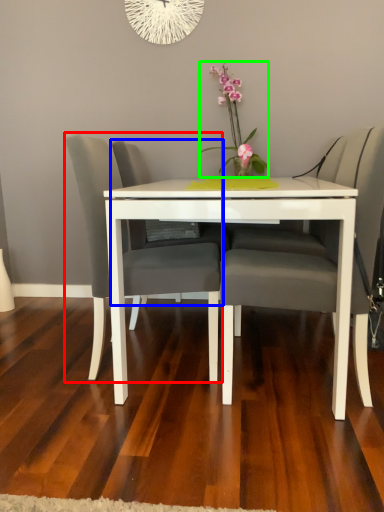
Question: Which object is the farthest from chair (highlighted by a red box)? Choose among these: swivel chair (highlighted by a blue box) or floral arrangement (highlighted by a green box).

Choices:
 (A) swivel chair
 (B) floral arrangement

Answer: (B)